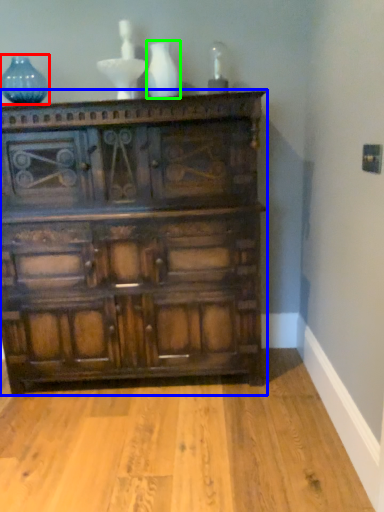
Question: Which object is positioned farthest from glass vase (highlighted by a red box)? Select from chest of drawers (highlighted by a blue box) and vase (highlighted by a green box).

Choices:
 (A) chest of drawers
 (B) vase

Answer: (A)